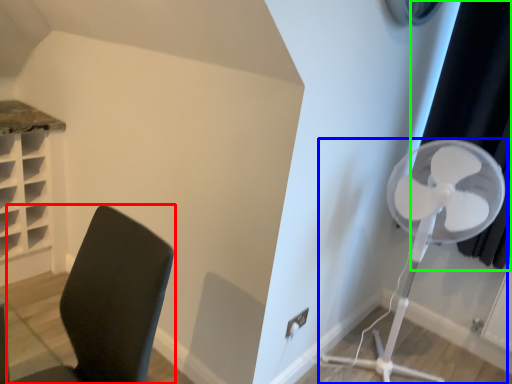
Question: Considering the real-world distances, which object is farthest from furniture (highlighted by a red box)? mechanical fan (highlighted by a blue box) or curtain (highlighted by a green box)?

Choices:
 (A) mechanical fan
 (B) curtain

Answer: (B)